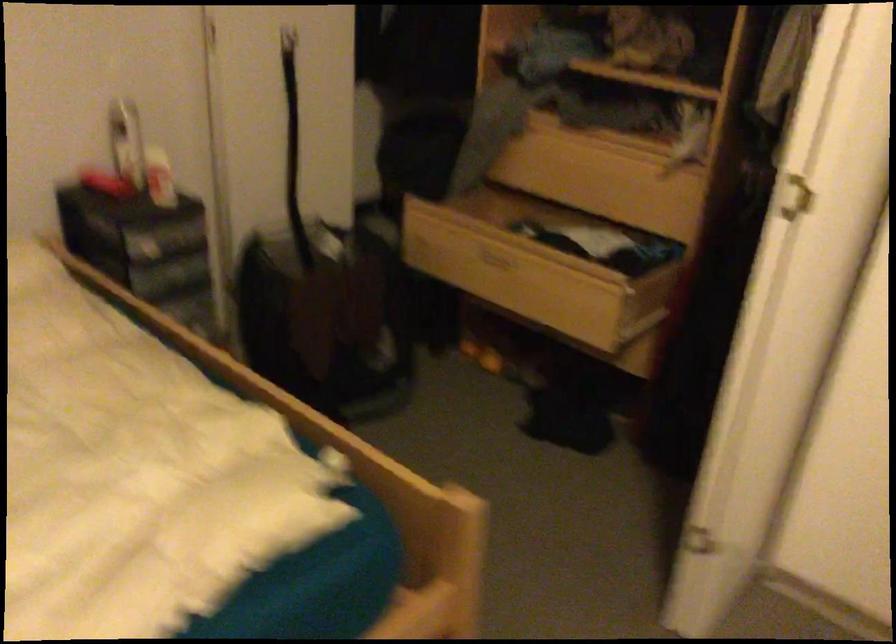
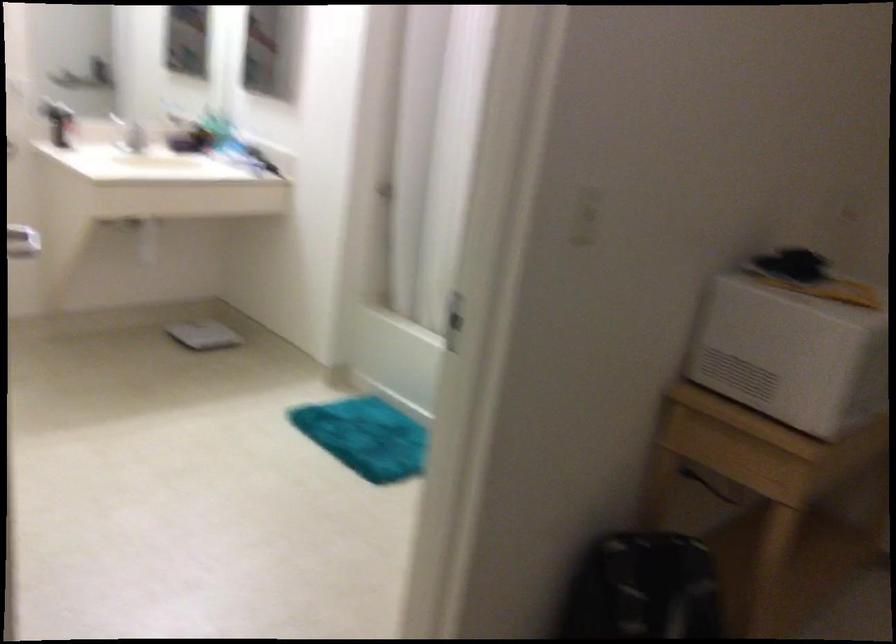
Question: The images are taken continuously from a first-person perspective. In which direction are you moving?

Choices:
 (A) Left
 (B) Right
 (C) Forward
 (D) Backward

Answer: (B)